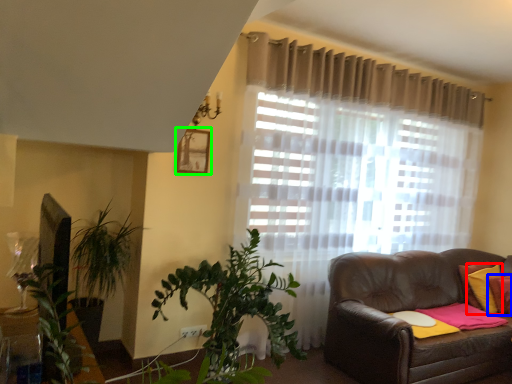
Question: Which object is the farthest from pillow (highlighted by a red box)? Choose among these: pillow (highlighted by a blue box) or picture frame (highlighted by a green box).

Choices:
 (A) pillow
 (B) picture frame

Answer: (B)